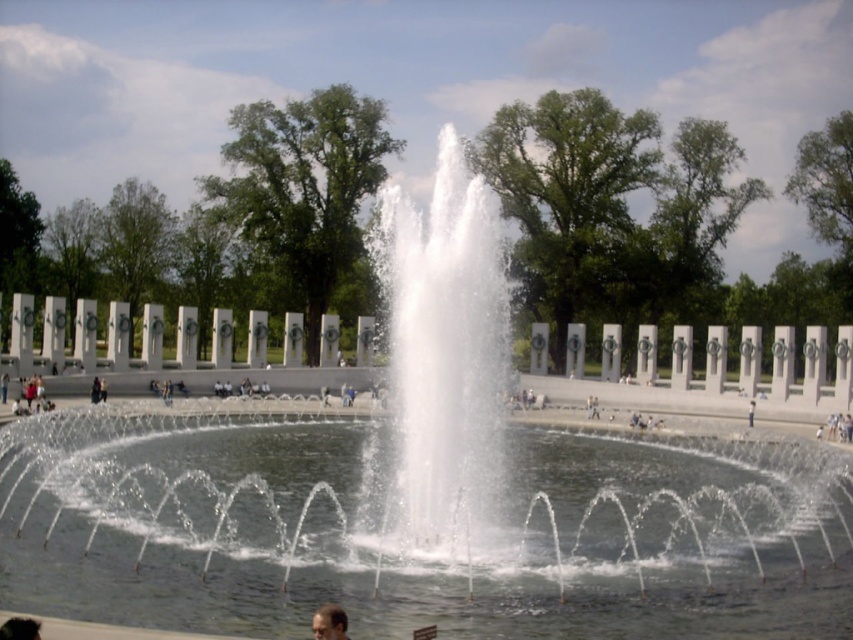
Who is positioned more to the left, smooth skin face at lower center or dark brown hair at lower left?

dark brown hair at lower left

Measure the distance between smooth skin face at lower center and camera.

smooth skin face at lower center and camera are 36.47 meters apart from each other.

This screenshot has height=640, width=853. What do you see at coordinates (329, 621) in the screenshot?
I see `smooth skin face at lower center` at bounding box center [329, 621].

At what (x,y) coordinates should I click in order to perform the action: click on smooth skin face at lower center. Please return your answer as a coordinate pair (x, y). Looking at the image, I should click on (329, 621).